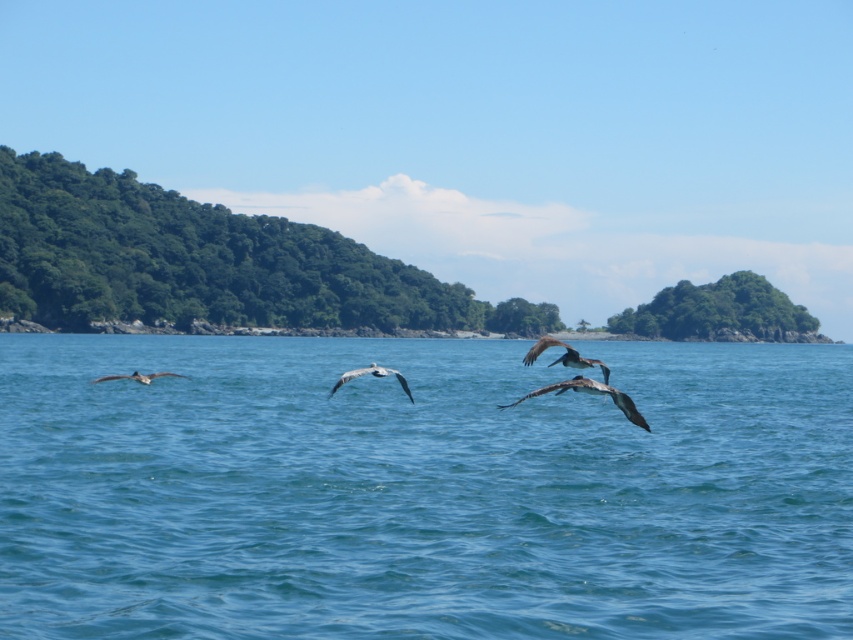
Question: Does blue water at center have a smaller size compared to gray matte bird at lower left?

Choices:
 (A) no
 (B) yes

Answer: (A)

Question: Which point appears farthest from the camera in this image?

Choices:
 (A) (363, 369)
 (B) (541, 339)
 (C) (566, 388)
 (D) (675, 381)

Answer: (D)

Question: Which object appears farthest from the camera in this image?

Choices:
 (A) gray matte pelican at center
 (B) gray feathered pelican at center

Answer: (B)

Question: Considering the real-world distances, which object is closest to the gray feathered pelican at center?

Choices:
 (A) gray feathered bird at center
 (B) gray matte bird at lower left

Answer: (A)

Question: Does gray feathered bird at center appear on the left side of gray matte bird at lower left?

Choices:
 (A) yes
 (B) no

Answer: (B)

Question: Can you confirm if gray matte pelican at center is positioned below gray feathered pelican at center?

Choices:
 (A) yes
 (B) no

Answer: (B)